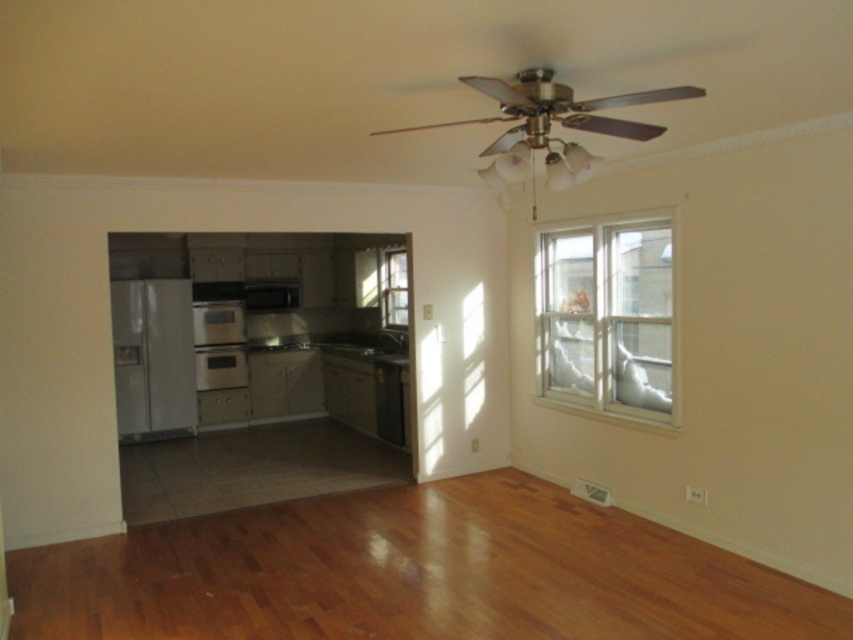
You are standing in the living room and want to open the white glass window at upper right. According to the coordinates provided, is the window closer to the ceiling or the floor?

The white glass window at upper right is located at point (607, 316). Since the y coordinate 0.713 is closer to 1.0, which represents the top of the image, the window is closer to the ceiling than the floor.

You are a delivery person carrying a package that requires a clear path to the kitchen. You see the black matte dishwasher at lower center and the clear glass window at center. Is there enough space between them to move the package through?

The black matte dishwasher at lower center is 1.21 meters from the clear glass window at center. Since the package requires a clear path, the distance between them is sufficient for moving the package through.